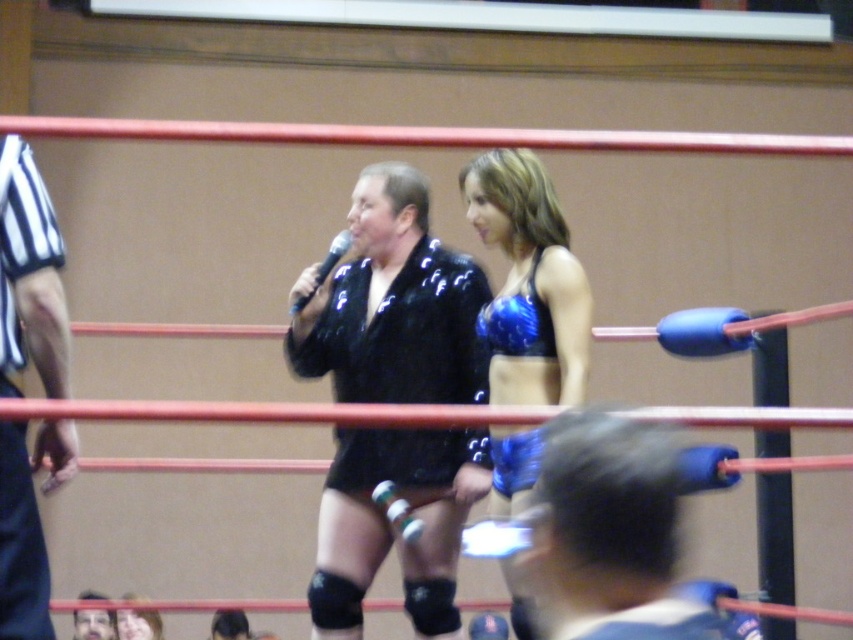
Is point (514, 396) positioned after point (86, 592)?

No, it is not.

Is blue metallic bikini top at center positioned before smooth black suit at center?

Yes.

At what (x,y) coordinates should I click in order to perform the action: click on blue metallic bikini top at center. Please return your answer as a coordinate pair (x, y). Looking at the image, I should click on pos(527,282).

Is shiny black jacket at center smaller than smooth black suit at center?

Incorrect, shiny black jacket at center is not smaller in size than smooth black suit at center.

Who is more distant from viewer, (440, 440) or (97, 636)?

Positioned behind is point (97, 636).

Where is `shiny black jacket at center`? shiny black jacket at center is located at coordinates (392, 305).

Which is above, smooth black suit at center or shiny blue bikini top at center?

shiny blue bikini top at center is above.

Which of these two, smooth black suit at center or shiny blue bikini top at center, stands taller?

Standing taller between the two is smooth black suit at center.

Identify the location of smooth black suit at center. The image size is (853, 640). (94, 625).